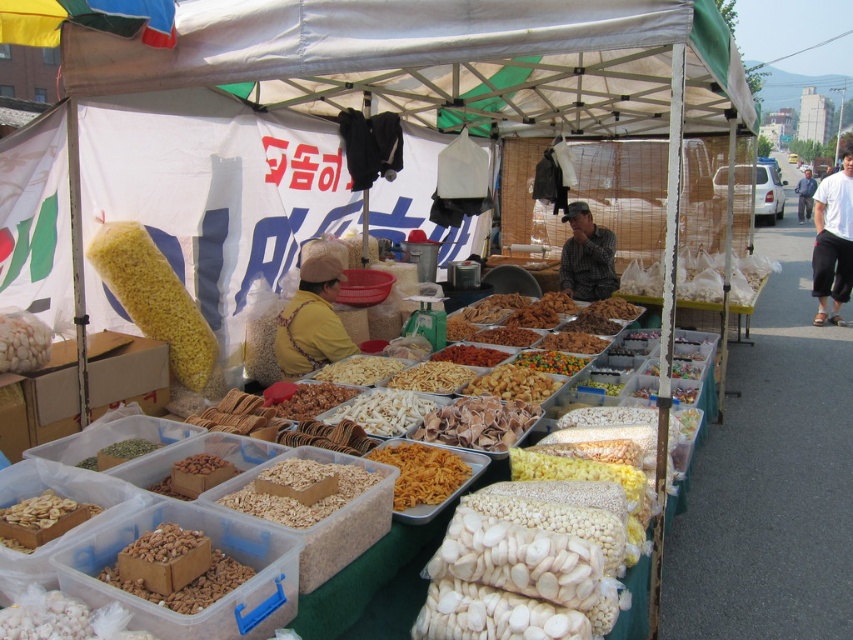
Question: Does white fabric canopy at upper center come behind brown cardboard box at lower left?

Choices:
 (A) no
 (B) yes

Answer: (B)

Question: Among these objects, which one is farthest from the camera?

Choices:
 (A) camouflage-patterned shirt at center
 (B) white cotton shirt at center
 (C) brown crunchy snack at center
 (D) yellowish-brown crispy snack at center

Answer: (B)

Question: Which point is farther to the camera?

Choices:
 (A) white matte corn at left
 (B) brown cardboard box at lower left
 (C) peeled beige nuts at lower left
 (D) yellow matte corn at center

Answer: (D)

Question: Does yellow fabric at center have a smaller size compared to white matte nuts at center?

Choices:
 (A) yes
 (B) no

Answer: (B)

Question: In this image, where is yellow fabric at center located relative to yellowish-brown crispy snack at center?

Choices:
 (A) right
 (B) left

Answer: (B)

Question: Which point appears farthest from the camera in this image?

Choices:
 (A) (6, 508)
 (B) (576, 54)
 (C) (323, 307)
 (D) (123, 556)

Answer: (B)